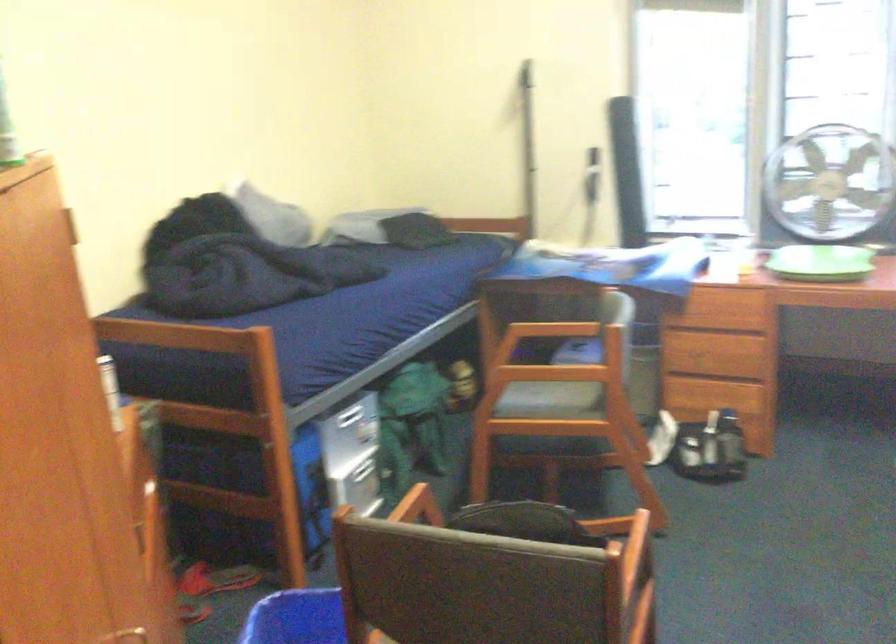
The height and width of the screenshot is (644, 896). Find the location of `gray chair seat`. gray chair seat is located at coordinates (540, 375).